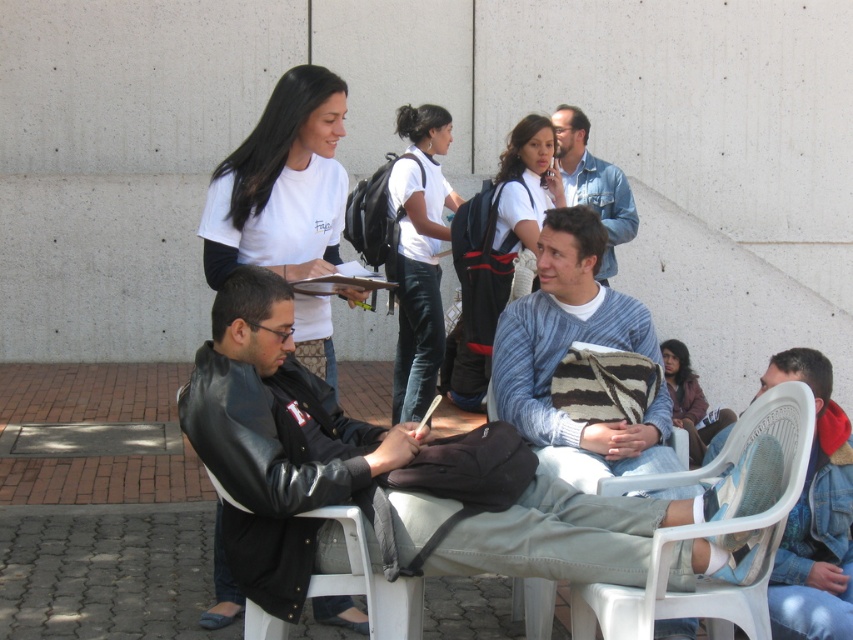
Who is lower down, denim jacket at lower right or white plastic chair at lower left?

white plastic chair at lower left

Which is more to the left, denim jacket at lower right or white plastic chair at lower left?

white plastic chair at lower left

Is point (828, 525) positioned before point (405, 618)?

No, it is not.

You are a GUI agent. You are given a task and a screenshot of the screen. Output one action in this format:
    pyautogui.click(x=<x>, y=<y>)
    Task: Click on the denim jacket at lower right
    The height and width of the screenshot is (640, 853).
    Given the screenshot: What is the action you would take?
    pyautogui.click(x=815, y=515)

Does point (496, 394) come behind point (473, 228)?

No.

Which is more to the left, knitted blue sweater at center or white cotton shirt at center?

From the viewer's perspective, white cotton shirt at center appears more on the left side.

You are a GUI agent. You are given a task and a screenshot of the screen. Output one action in this format:
    pyautogui.click(x=<x>, y=<y>)
    Task: Click on the knitted blue sweater at center
    The image size is (853, 640).
    Given the screenshot: What is the action you would take?
    pyautogui.click(x=566, y=353)

What do you see at coordinates (281, 184) in the screenshot? I see `white matte t-shirt at upper center` at bounding box center [281, 184].

Is white matte t-shirt at upper center smaller than white matte shirt at center?

Yes.

The height and width of the screenshot is (640, 853). What do you see at coordinates (281, 184) in the screenshot?
I see `white matte t-shirt at upper center` at bounding box center [281, 184].

You are a GUI agent. You are given a task and a screenshot of the screen. Output one action in this format:
    pyautogui.click(x=<x>, y=<y>)
    Task: Click on the white matte t-shirt at upper center
    This screenshot has height=640, width=853.
    Given the screenshot: What is the action you would take?
    pyautogui.click(x=281, y=184)